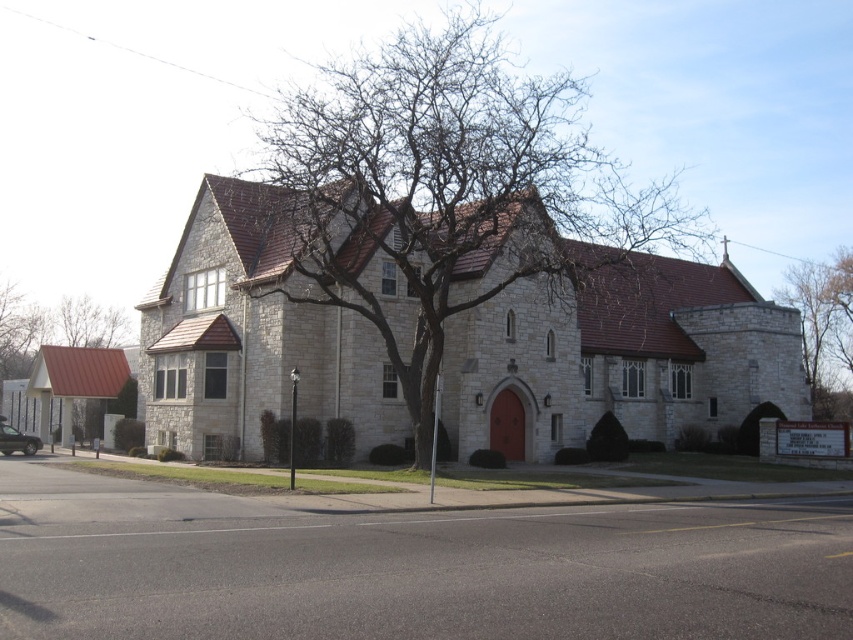
Question: Can you confirm if bare stone tree at upper right is thinner than brown textured roof at upper left?

Choices:
 (A) no
 (B) yes

Answer: (A)

Question: Which of these objects is positioned farthest from the bare branches at center?

Choices:
 (A) brown textured roof at upper left
 (B) bare stone tree at upper right

Answer: (A)

Question: Where is bare branches at center located in relation to bare stone tree at upper right in the image?

Choices:
 (A) below
 (B) above

Answer: (B)

Question: Which of the following is the farthest from the observer?

Choices:
 (A) brown textured roof at upper left
 (B) bare branches at center
 (C) bare stone tree at upper right

Answer: (A)

Question: Which object is positioned farthest from the bare stone tree at upper right?

Choices:
 (A) bare branches at center
 (B) brown textured roof at upper left

Answer: (B)

Question: Does bare branches at center have a larger size compared to bare stone tree at upper right?

Choices:
 (A) no
 (B) yes

Answer: (B)